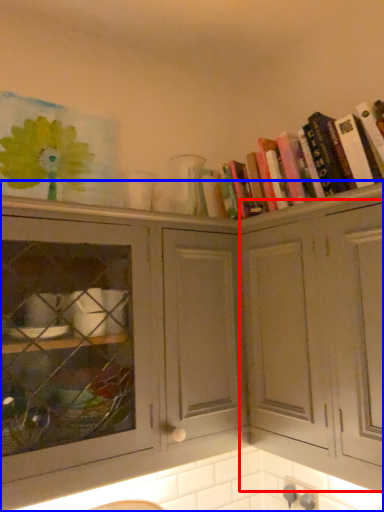
Question: Among these objects, which one is nearest to the camera, cabinetry (highlighted by a red box) or cabinetry (highlighted by a blue box)?

Choices:
 (A) cabinetry
 (B) cabinetry

Answer: (A)